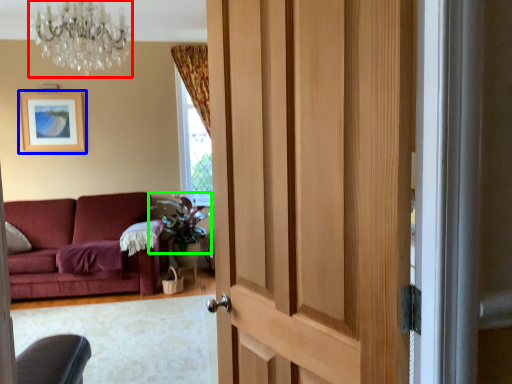
Question: Which is nearer to the chandelier (highlighted by a red box)? picture frame (highlighted by a blue box) or plant (highlighted by a green box).

Choices:
 (A) picture frame
 (B) plant

Answer: (B)